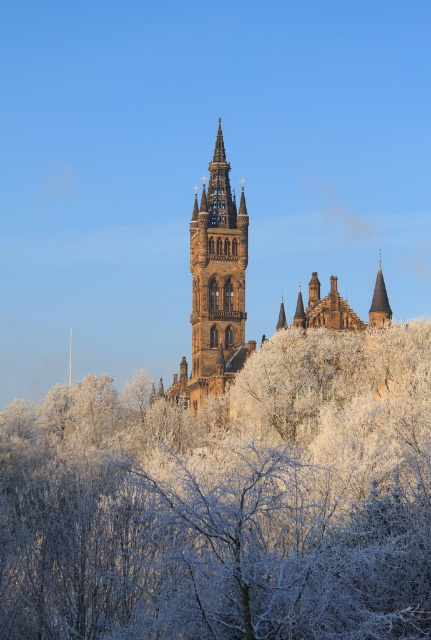
Question: Can you confirm if brown stone church at center is smaller than smooth brown spire at upper right?

Choices:
 (A) no
 (B) yes

Answer: (A)

Question: Which of the following is the closest to the observer?

Choices:
 (A) (359, 524)
 (B) (384, 291)
 (C) (243, 288)

Answer: (A)

Question: Considering the relative positions of brown stone church at center and stone gothic tower at center in the image provided, where is brown stone church at center located with respect to stone gothic tower at center?

Choices:
 (A) right
 (B) left

Answer: (A)

Question: Is brown stone church at center below smooth brown spire at upper right?

Choices:
 (A) yes
 (B) no

Answer: (B)

Question: Which of these objects is positioned farthest from the stone gothic tower at center?

Choices:
 (A) frosted white branches at center
 (B) brown stone church at center

Answer: (A)

Question: Among these objects, which one is nearest to the camera?

Choices:
 (A) stone gothic tower at center
 (B) brown stone church at center
 (C) frosted white branches at center

Answer: (C)